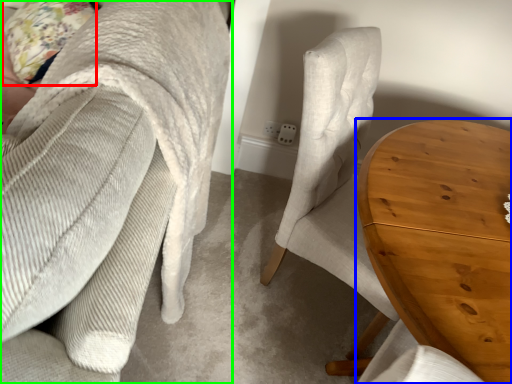
Question: Based on their relative distances, which object is farther from pillow (highlighted by a red box)? Choose from table (highlighted by a blue box) and chair (highlighted by a green box).

Choices:
 (A) table
 (B) chair

Answer: (A)